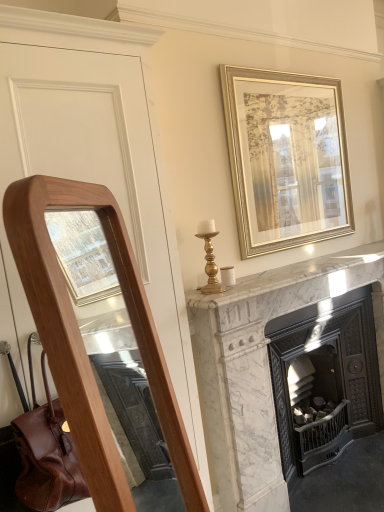
This screenshot has height=512, width=384. I want to click on white marble fireplace at center, so click(262, 367).

Image resolution: width=384 pixels, height=512 pixels. Describe the element at coordinates (262, 367) in the screenshot. I see `white marble fireplace at center` at that location.

Find the location of `gold metallic picture frame at upper center`. gold metallic picture frame at upper center is located at coordinates (286, 158).

What do you see at coordinates (286, 158) in the screenshot?
I see `gold metallic picture frame at upper center` at bounding box center [286, 158].

In order to face gold metallic picture frame at upper center, should I rotate leftwards or rightwards?

To face it directly, rotate right by 13.539 degrees.

Locate an element on the screen. The width and height of the screenshot is (384, 512). white marble fireplace at center is located at coordinates (262, 367).

From the picture: Which is more to the left, gold metallic picture frame at upper center or white marble fireplace at center?

gold metallic picture frame at upper center.

Between gold metallic picture frame at upper center and white marble fireplace at center, which one is positioned behind?

gold metallic picture frame at upper center is further away from the camera.

Considering the positions of point (247, 95) and point (241, 442), is point (247, 95) closer or farther from the camera than point (241, 442)?

Point (247, 95) is farther from the camera than point (241, 442).

From the image's perspective, is gold metallic picture frame at upper center on white marble fireplace at center?

Indeed, from the image's perspective, gold metallic picture frame at upper center is shown above white marble fireplace at center.

From a real-world perspective, relative to white marble fireplace at center, is gold metallic picture frame at upper center vertically above or below?

gold metallic picture frame at upper center is situated higher than white marble fireplace at center in the real world.

Is gold metallic picture frame at upper center wider than white marble fireplace at center?

Incorrect, the width of gold metallic picture frame at upper center does not surpass that of white marble fireplace at center.

Is gold metallic picture frame at upper center taller than white marble fireplace at center?

In fact, gold metallic picture frame at upper center may be shorter than white marble fireplace at center.

Between gold metallic picture frame at upper center and white marble fireplace at center, which one has larger size?

white marble fireplace at center is bigger.

Is white marble fireplace at center surrounded by gold metallic picture frame at upper center?

That's incorrect, white marble fireplace at center is not inside gold metallic picture frame at upper center.

Are gold metallic picture frame at upper center and white marble fireplace at center beside each other?

gold metallic picture frame at upper center is not next to white marble fireplace at center, and they're not touching.

Consider the image. Could you tell me if gold metallic picture frame at upper center is turned towards white marble fireplace at center?

No, gold metallic picture frame at upper center is not facing towards white marble fireplace at center.

How far apart are gold metallic picture frame at upper center and white marble fireplace at center?

gold metallic picture frame at upper center is 21.70 inches from white marble fireplace at center.

Find the location of a particular element. The width and height of the screenshot is (384, 512). picture frame lying behind the white marble fireplace at center is located at coordinates (286, 158).

Looking at this image, in the image, is white marble fireplace at center on the left side or the right side of gold metallic picture frame at upper center?

In the image, white marble fireplace at center appears on the right side of gold metallic picture frame at upper center.

From the picture: Is white marble fireplace at center closer to the viewer compared to gold metallic picture frame at upper center?

Yes, white marble fireplace at center is closer to the viewer.

Does point (199, 300) come farther from viewer compared to point (273, 143)?

No.

From the picture: From the image's perspective, is white marble fireplace at center located above gold metallic picture frame at upper center?

Answer: Actually, white marble fireplace at center appears below gold metallic picture frame at upper center in the image.

From a real-world perspective, relative to gold metallic picture frame at upper center, is white marble fireplace at center vertically above or below?

white marble fireplace at center is below gold metallic picture frame at upper center.

Is white marble fireplace at center thinner than gold metallic picture frame at upper center?

No, white marble fireplace at center is not thinner than gold metallic picture frame at upper center.

Considering the relative sizes of white marble fireplace at center and gold metallic picture frame at upper center in the image provided, is white marble fireplace at center taller than gold metallic picture frame at upper center?

Indeed, white marble fireplace at center has a greater height compared to gold metallic picture frame at upper center.

Who is bigger, white marble fireplace at center or gold metallic picture frame at upper center?

With larger size is white marble fireplace at center.

Can gold metallic picture frame at upper center be found inside white marble fireplace at center?

No, gold metallic picture frame at upper center is not surrounded by white marble fireplace at center.

Is white marble fireplace at center directly adjacent to gold metallic picture frame at upper center?

No, white marble fireplace at center is not in contact with gold metallic picture frame at upper center.

Is white marble fireplace at center turned away from gold metallic picture frame at upper center?

No, white marble fireplace at center is not facing the opposite direction of gold metallic picture frame at upper center.

How distant is white marble fireplace at center from gold metallic picture frame at upper center?

21.70 inches.

This screenshot has width=384, height=512. Find the location of `fireplace located in front of the gold metallic picture frame at upper center`. fireplace located in front of the gold metallic picture frame at upper center is located at coordinates (262, 367).

Locate an element on the screen. picture frame behind the white marble fireplace at center is located at coordinates (286, 158).

Where is `picture frame above the white marble fireplace at center (from a real-world perspective)`? The image size is (384, 512). picture frame above the white marble fireplace at center (from a real-world perspective) is located at coordinates (286, 158).